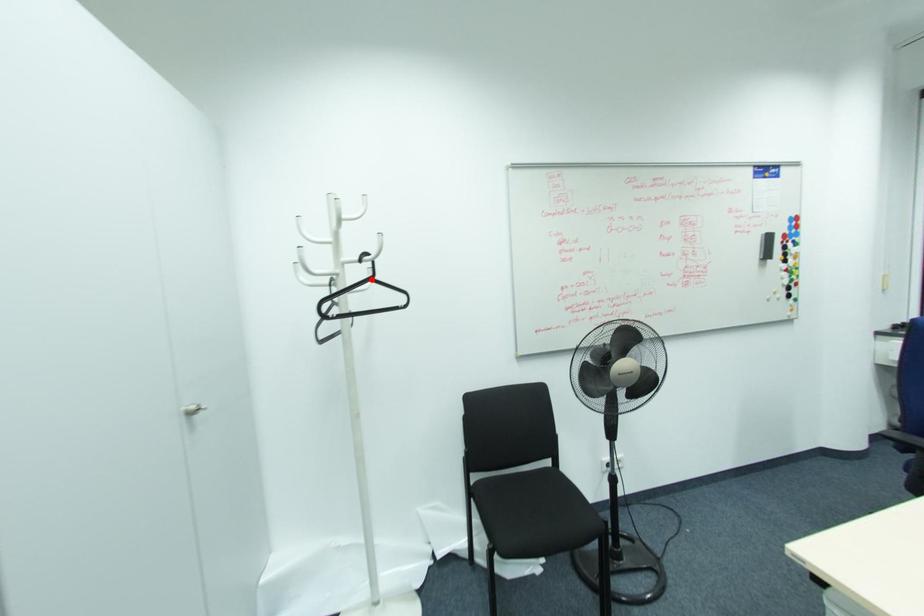
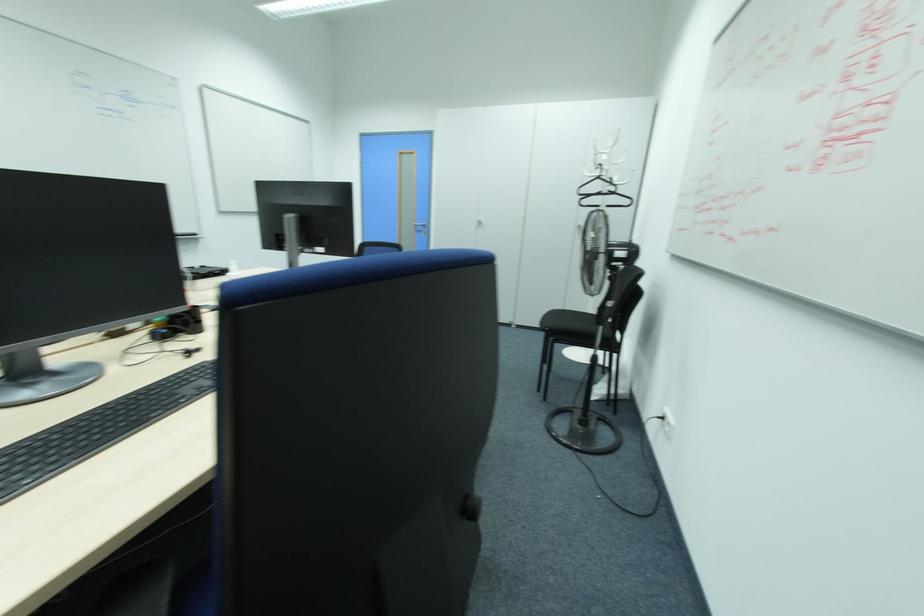
In the second image, find the point that corresponds to the highlighted location in the first image.

(599, 177)